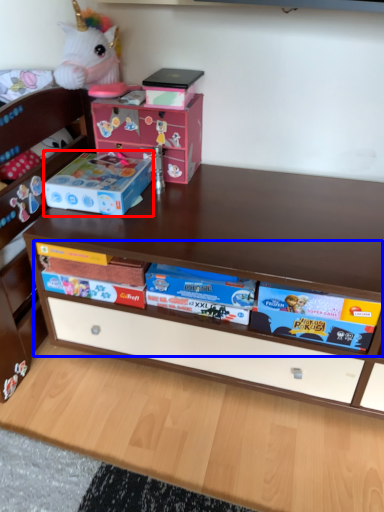
Question: Which object is further to the camera taking this photo, storage box (highlighted by a red box) or book (highlighted by a blue box)?

Choices:
 (A) storage box
 (B) book

Answer: (A)